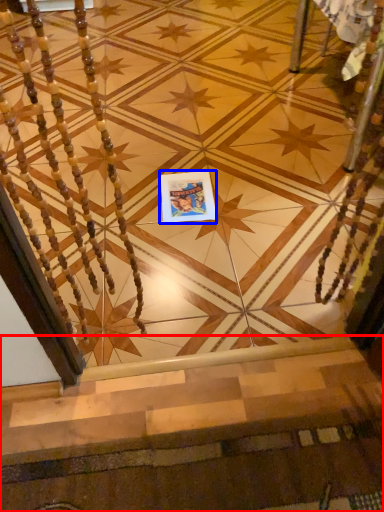
Question: Which of the following is the closest to the observer, stairs (highlighted by a red box) or postcard (highlighted by a blue box)?

Choices:
 (A) stairs
 (B) postcard

Answer: (A)